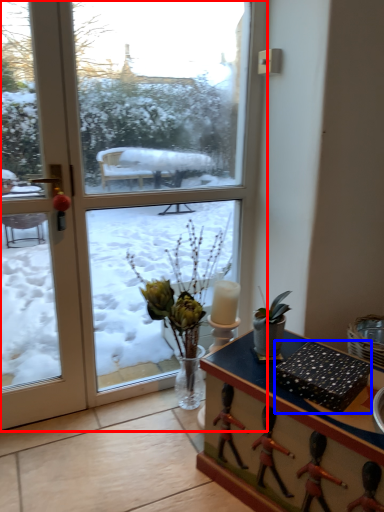
Question: Which object appears closest to the camera in this image, window (highlighted by a red box) or box (highlighted by a blue box)?

Choices:
 (A) window
 (B) box

Answer: (B)